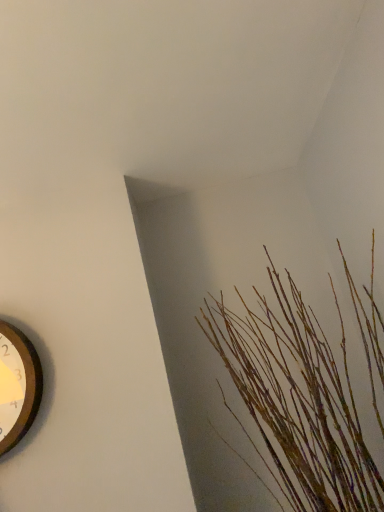
What do you see at coordinates (21, 381) in the screenshot?
I see `wooden clock at left` at bounding box center [21, 381].

This screenshot has height=512, width=384. Identify the location of wooden clock at left. (21, 381).

The image size is (384, 512). What are the coordinates of `brown textured sticks at upper right` in the screenshot? It's located at (298, 402).

What do you see at coordinates (298, 402) in the screenshot? I see `brown textured sticks at upper right` at bounding box center [298, 402].

Locate an element on the screen. wooden clock at left is located at coordinates (21, 381).

Considering the positions of objects brown textured sticks at upper right and wooden clock at left in the image provided, who is more to the left, brown textured sticks at upper right or wooden clock at left?

Positioned to the left is wooden clock at left.

Does brown textured sticks at upper right lie behind wooden clock at left?

That is False.

Between point (304, 383) and point (35, 389), which one is positioned behind?

The point (35, 389) is farther.

From the picture: From the image's perspective, which object appears higher, brown textured sticks at upper right or wooden clock at left?

brown textured sticks at upper right is shown above in the image.

From a real-world perspective, between brown textured sticks at upper right and wooden clock at left, who is vertically lower?

From a 3D spatial view, brown textured sticks at upper right is below.

Looking at their sizes, would you say brown textured sticks at upper right is wider or thinner than wooden clock at left?

brown textured sticks at upper right is wider than wooden clock at left.

From the picture: Does brown textured sticks at upper right have a greater height compared to wooden clock at left?

Yes.

From the picture: Is brown textured sticks at upper right smaller than wooden clock at left?

Incorrect, brown textured sticks at upper right is not smaller in size than wooden clock at left.

Which is correct: brown textured sticks at upper right is inside wooden clock at left, or outside of it?

brown textured sticks at upper right is not enclosed by wooden clock at left.

Consider the image. Is brown textured sticks at upper right with wooden clock at left?

brown textured sticks at upper right and wooden clock at left are clearly separated.

Consider the image. Is brown textured sticks at upper right facing towards wooden clock at left?

No, brown textured sticks at upper right is not facing towards wooden clock at left.

How many degrees apart are the facing directions of brown textured sticks at upper right and wooden clock at left?

The angular difference between brown textured sticks at upper right and wooden clock at left is 0.422 degrees.

How much distance is there between brown textured sticks at upper right and wooden clock at left?

brown textured sticks at upper right and wooden clock at left are 29.45 inches apart.

Locate an element on the screen. houseplant that appears below the wooden clock at left (from a real-world perspective) is located at coordinates (298, 402).

Which is more to the right, wooden clock at left or brown textured sticks at upper right?

brown textured sticks at upper right is more to the right.

Is wooden clock at left closer to the viewer compared to brown textured sticks at upper right?

No.

Is point (7, 370) in front of point (223, 341)?

Yes, it is in front of point (223, 341).

From the image's perspective, who appears lower, wooden clock at left or brown textured sticks at upper right?

wooden clock at left.

From a real-world perspective, is wooden clock at left positioned over brown textured sticks at upper right based on gravity?

Yes, from a real-world perspective, wooden clock at left is on top of brown textured sticks at upper right.

Does wooden clock at left have a greater width compared to brown textured sticks at upper right?

No, wooden clock at left is not wider than brown textured sticks at upper right.

Is wooden clock at left shorter than brown textured sticks at upper right?

Correct, wooden clock at left is not as tall as brown textured sticks at upper right.

Considering the sizes of objects wooden clock at left and brown textured sticks at upper right in the image provided, who is smaller, wooden clock at left or brown textured sticks at upper right?

wooden clock at left.

Is brown textured sticks at upper right surrounded by wooden clock at left?

Actually, brown textured sticks at upper right is outside wooden clock at left.

Are wooden clock at left and brown textured sticks at upper right located far from each other?

That's not correct — wooden clock at left is a little close to brown textured sticks at upper right.

From the picture: Is wooden clock at left facing towards brown textured sticks at upper right?

No, wooden clock at left is not facing towards brown textured sticks at upper right.

How many degrees apart are the facing directions of wooden clock at left and brown textured sticks at upper right?

They differ by 0.422 degrees in their facing directions.

How much distance is there between wooden clock at left and brown textured sticks at upper right?

wooden clock at left is 74.81 centimeters from brown textured sticks at upper right.

The height and width of the screenshot is (512, 384). What are the coordinates of `wall clock behind the brown textured sticks at upper right` in the screenshot? It's located at (21, 381).

You are a GUI agent. You are given a task and a screenshot of the screen. Output one action in this format:
    pyautogui.click(x=<x>, y=<y>)
    Task: Click on the houseplant lying in front of the wooden clock at left
    This screenshot has height=512, width=384.
    Given the screenshot: What is the action you would take?
    pyautogui.click(x=298, y=402)

Locate an element on the screen. The image size is (384, 512). houseplant that appears on the right of wooden clock at left is located at coordinates (298, 402).